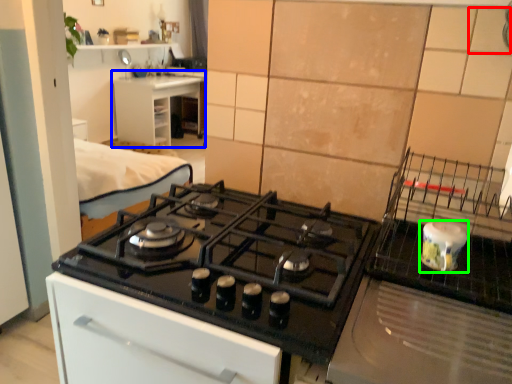
Question: Which object is the closest to the tile (highlighted by a red box)? Choose among these: counter top (highlighted by a blue box) or kitchen appliance (highlighted by a green box).

Choices:
 (A) counter top
 (B) kitchen appliance

Answer: (B)